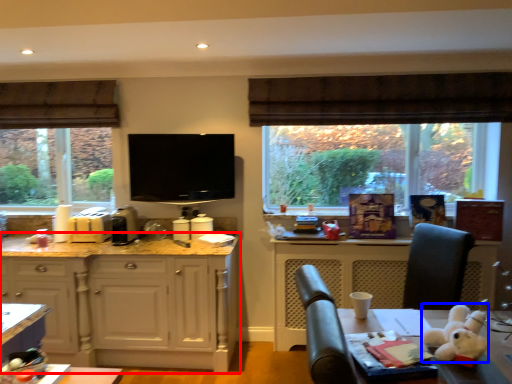
Question: Among these objects, which one is nearest to the camera, cabinetry (highlighted by a red box) or animal (highlighted by a blue box)?

Choices:
 (A) cabinetry
 (B) animal

Answer: (B)